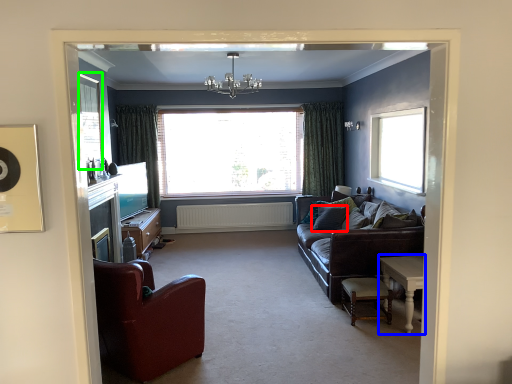
Question: Estimate the real-world distances between objects in this image. Which object is farther from pillow (highlighted by a red box), table (highlighted by a blue box) or window screen (highlighted by a green box)?

Choices:
 (A) table
 (B) window screen

Answer: (B)